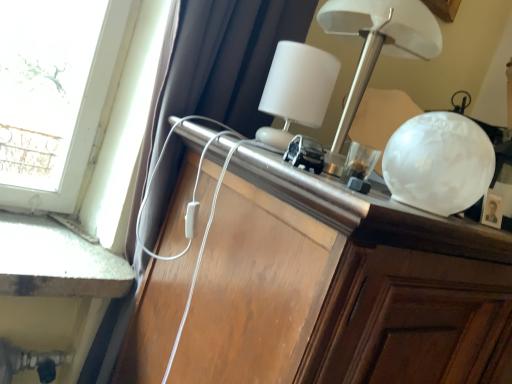
Question: Does wooden cabinet at center have a greater width compared to white matte table lamp at upper center?

Choices:
 (A) yes
 (B) no

Answer: (A)

Question: Can you confirm if wooden cabinet at center is shorter than white matte table lamp at upper center?

Choices:
 (A) yes
 (B) no

Answer: (B)

Question: From the image's perspective, is wooden cabinet at center over white matte table lamp at upper center?

Choices:
 (A) no
 (B) yes

Answer: (A)

Question: Can you confirm if wooden cabinet at center is thinner than white matte table lamp at upper center?

Choices:
 (A) no
 (B) yes

Answer: (A)

Question: Would you say wooden cabinet at center contains white matte table lamp at upper center?

Choices:
 (A) yes
 (B) no

Answer: (B)

Question: Relative to wooden cabinet at center, is white matte table lamp at upper center in front or behind?

Choices:
 (A) front
 (B) behind

Answer: (B)

Question: Considering the positions of white matte table lamp at upper center and wooden cabinet at center in the image, is white matte table lamp at upper center taller or shorter than wooden cabinet at center?

Choices:
 (A) short
 (B) tall

Answer: (A)

Question: From the image's perspective, relative to wooden cabinet at center, is white matte table lamp at upper center above or below?

Choices:
 (A) below
 (B) above

Answer: (B)

Question: Considering the positions of white matte table lamp at upper center and wooden cabinet at center in the image, is white matte table lamp at upper center wider or thinner than wooden cabinet at center?

Choices:
 (A) wide
 (B) thin

Answer: (B)

Question: From the image's perspective, is white glossy lamp at upper center above or below wooden cabinet at center?

Choices:
 (A) above
 (B) below

Answer: (A)

Question: In terms of height, does white glossy lamp at upper center look taller or shorter compared to wooden cabinet at center?

Choices:
 (A) short
 (B) tall

Answer: (A)

Question: Is white glossy lamp at upper center bigger or smaller than wooden cabinet at center?

Choices:
 (A) small
 (B) big

Answer: (A)

Question: Do you think white glossy lamp at upper center is within wooden cabinet at center, or outside of it?

Choices:
 (A) inside
 (B) outside

Answer: (B)

Question: From their relative heights in the image, would you say wooden cabinet at center is taller or shorter than white glossy lamp at upper center?

Choices:
 (A) short
 (B) tall

Answer: (B)

Question: From a real-world perspective, is wooden cabinet at center above or below white glossy lamp at upper center?

Choices:
 (A) above
 (B) below

Answer: (B)